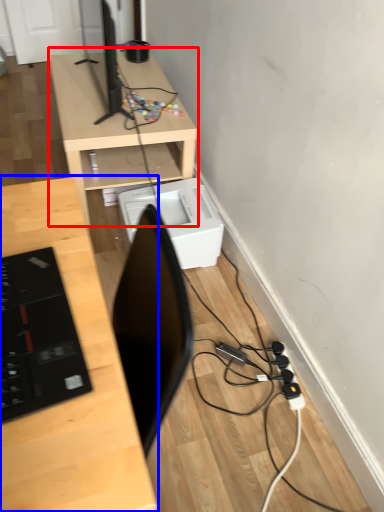
Question: Which object is further to the camera taking this photo, desk (highlighted by a red box) or desk (highlighted by a blue box)?

Choices:
 (A) desk
 (B) desk

Answer: (A)